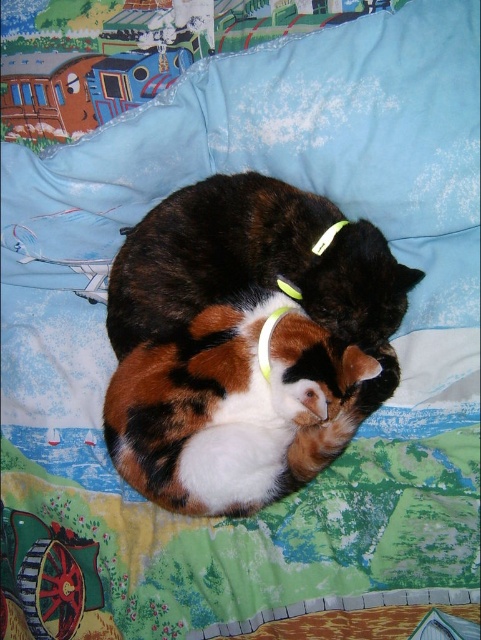
Question: Which point is farther from the camera taking this photo?

Choices:
 (A) click(292, 225)
 (B) click(260, 364)

Answer: (A)

Question: Which point is farther from the camera taking this photo?

Choices:
 (A) (326, 250)
 (B) (264, 492)
 (C) (265, 344)

Answer: (A)

Question: Which point is closer to the camera?

Choices:
 (A) (305, 330)
 (B) (265, 333)
 (C) (262, 348)

Answer: (C)

Question: Is the position of calico fur cat at center more distant than that of yellow fabric neckband at center?

Choices:
 (A) yes
 (B) no

Answer: (B)

Question: Does neon yellow fabric at center have a smaller size compared to yellow fabric neckband at center?

Choices:
 (A) yes
 (B) no

Answer: (B)

Question: Is calico fur cat at center below neon yellow fabric at center?

Choices:
 (A) no
 (B) yes

Answer: (B)